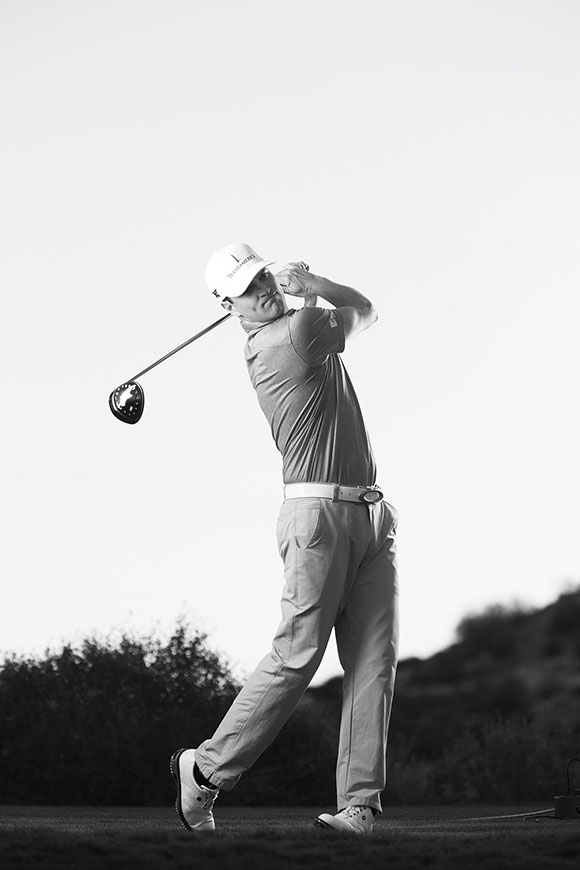
Image resolution: width=580 pixels, height=870 pixels. Find the location of `plant`. plant is located at coordinates (97, 699).